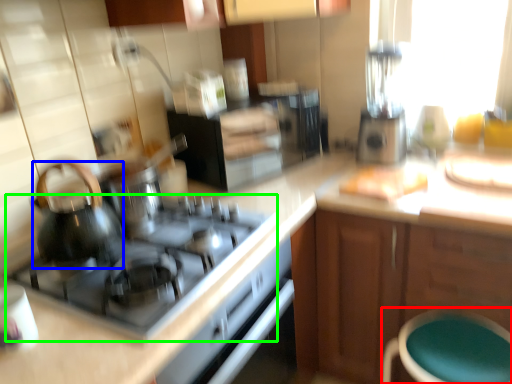
Question: Which object is the closest to the bar stool (highlighted by a red box)? Choose among these: kitchen appliance (highlighted by a blue box) or gas stove (highlighted by a green box).

Choices:
 (A) kitchen appliance
 (B) gas stove

Answer: (B)